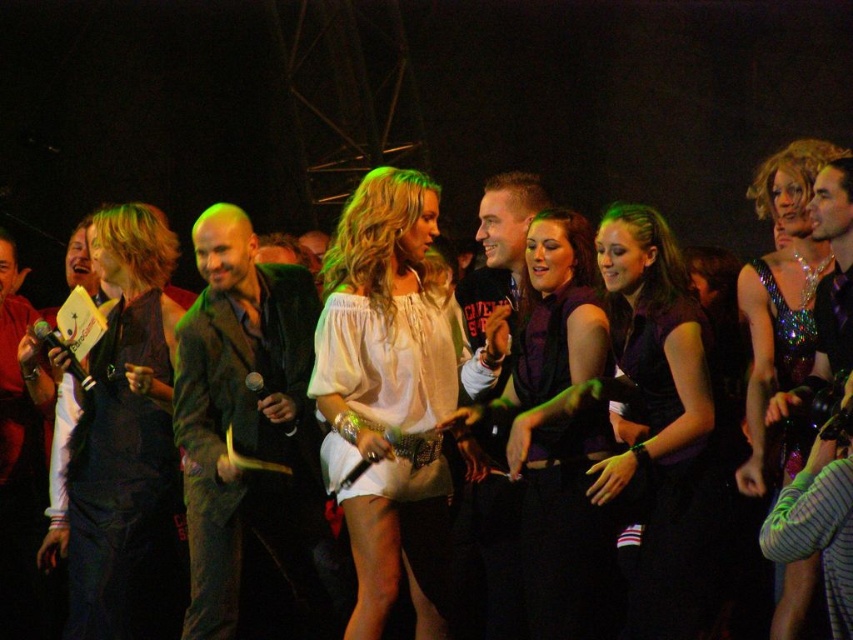
Does white fabric dress at center have a larger size compared to matte black vest at left?

Yes, white fabric dress at center is bigger than matte black vest at left.

Measure the distance from white fabric dress at center to matte black vest at left.

white fabric dress at center is 3.67 feet away from matte black vest at left.

Does point (422, 563) come farther from viewer compared to point (154, 573)?

No, (422, 563) is closer to viewer.

Locate an element on the screen. Image resolution: width=853 pixels, height=640 pixels. white fabric dress at center is located at coordinates (392, 396).

Is velvet green jacket at center below matte black dress at center?

Yes.

Is velvet green jacket at center wider than matte black dress at center?

Indeed, velvet green jacket at center has a greater width compared to matte black dress at center.

Is point (224, 435) farther from camera compared to point (525, 371)?

Yes, it is.

Find the location of a particular element. The image size is (853, 640). velvet green jacket at center is located at coordinates (248, 428).

Between sparkly sequined dress at center and velvet purple dress at center, which one has more height?

velvet purple dress at center

The image size is (853, 640). What do you see at coordinates (793, 305) in the screenshot? I see `sparkly sequined dress at center` at bounding box center [793, 305].

Find the location of a particular element. The height and width of the screenshot is (640, 853). sparkly sequined dress at center is located at coordinates (793, 305).